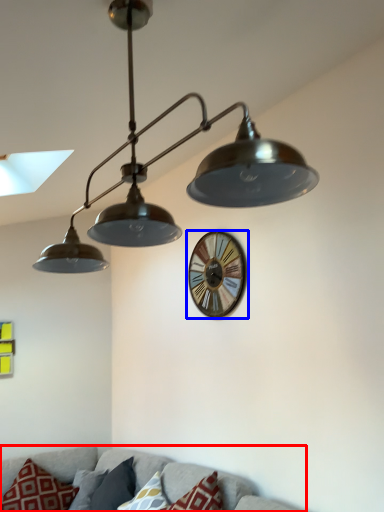
Question: Which point is closer to the camera, couch (highlighted by a red box) or wall clock (highlighted by a blue box)?

Choices:
 (A) couch
 (B) wall clock

Answer: (A)